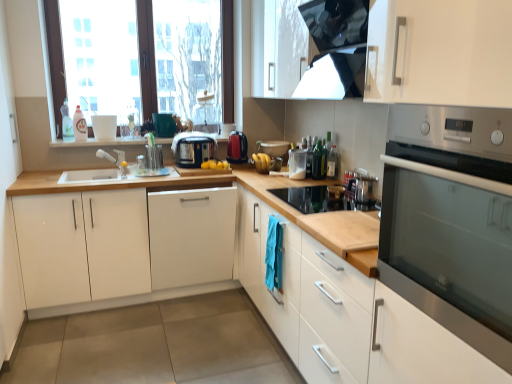
Image resolution: width=512 pixels, height=384 pixels. What are the coordinates of `clear plastic container at center, positioned as the 2th appliance in right-to-left order` in the screenshot? It's located at (297, 164).

How much space does clear plastic container at center, which is counted as the second appliance, starting from the front, occupy horizontally?

clear plastic container at center, which is counted as the second appliance, starting from the front, is 5.67 inches wide.

This screenshot has height=384, width=512. Identify the location of green glass bottle at center, which appears as the 2th bottle when viewed from the front. (319, 161).

This screenshot has height=384, width=512. Identify the location of satin silver toaster at upper right, placed as the 1th appliance when sorted from bottom to top. (364, 189).

The image size is (512, 384). What do you see at coordinates (115, 160) in the screenshot?
I see `white plastic faucet at upper left` at bounding box center [115, 160].

How much space does transparent plastic bottle at upper right, which appears as the 1th bottle when viewed from the front, occupy vertically?

The height of transparent plastic bottle at upper right, which appears as the 1th bottle when viewed from the front, is 9.37 inches.

What are the coordinates of `translucent plastic bottle at upper left, which is the third bottle from front to back` in the screenshot? It's located at (79, 126).

Considering the positions of point (262, 143) and point (365, 199), is point (262, 143) closer or farther from the camera than point (365, 199)?

Clearly, point (262, 143) is more distant from the camera than point (365, 199).

Which of these two, matte white bowl at center, placed as the third appliance when sorted from bottom to top, or satin silver toaster at upper right, the first appliance from the right, stands taller?

satin silver toaster at upper right, the first appliance from the right.

From a real-world perspective, is matte white bowl at center, which is the 3th appliance in front-to-back order, located beneath satin silver toaster at upper right, which ranks as the third appliance in top-to-bottom order?

No, from a real-world perspective, matte white bowl at center, which is the 3th appliance in front-to-back order, is not beneath satin silver toaster at upper right, which ranks as the third appliance in top-to-bottom order.

Consider the image. Between matte white bowl at center, the 1th appliance in the top-to-bottom sequence, and satin silver toaster at upper right, placed as the 1th appliance when sorted from front to back, which one appears on the right side from the viewer's perspective?

From the viewer's perspective, satin silver toaster at upper right, placed as the 1th appliance when sorted from front to back, appears more on the right side.

Is shiny plastic kettle at center, the first kitchen appliance viewed from the right, not close to white matte cabinet at left, which is the third cabinetry in right-to-left order?

No, shiny plastic kettle at center, the first kitchen appliance viewed from the right, is not far from white matte cabinet at left, which is the third cabinetry in right-to-left order.

Is point (230, 146) closer or farther from the camera than point (200, 279)?

Point (230, 146) is positioned farther from the camera compared to point (200, 279).

In the image, is shiny plastic kettle at center, the first kitchen appliance viewed from the right, positioned in front of or behind white matte cabinet at left, which is the third cabinetry in right-to-left order?

shiny plastic kettle at center, the first kitchen appliance viewed from the right, is behind white matte cabinet at left, which is the third cabinetry in right-to-left order.

Considering the sizes of objects shiny plastic kettle at center, the first kitchen appliance viewed from the right, and white matte cabinet at left, arranged as the first cabinetry when viewed from the left, in the image provided, who is wider, shiny plastic kettle at center, the first kitchen appliance viewed from the right, or white matte cabinet at left, arranged as the first cabinetry when viewed from the left,?

Wider between the two is white matte cabinet at left, arranged as the first cabinetry when viewed from the left.

How far apart are shiny plastic kettle at center, positioned as the 2th kitchen appliance in left-to-right order, and white plastic faucet at upper left?

A distance of 33.03 inches exists between shiny plastic kettle at center, positioned as the 2th kitchen appliance in left-to-right order, and white plastic faucet at upper left.

Considering the relative sizes of shiny plastic kettle at center, positioned as the 2th kitchen appliance in left-to-right order, and white plastic faucet at upper left in the image provided, is shiny plastic kettle at center, positioned as the 2th kitchen appliance in left-to-right order, wider than white plastic faucet at upper left?

Correct, the width of shiny plastic kettle at center, positioned as the 2th kitchen appliance in left-to-right order, exceeds that of white plastic faucet at upper left.

Is shiny plastic kettle at center, positioned as the 2th kitchen appliance in left-to-right order, facing towards white plastic faucet at upper left?

No.

Is green glass bottle at center, the 2th bottle viewed from the left, at the left side of white matte cabinet at right, which is counted as the third cabinetry, starting from the left?

In fact, green glass bottle at center, the 2th bottle viewed from the left, is to the right of white matte cabinet at right, which is counted as the third cabinetry, starting from the left.

Is green glass bottle at center, the 2th bottle viewed from the left, bigger or smaller than white matte cabinet at right, positioned as the 1th cabinetry in right-to-left order?

Clearly, green glass bottle at center, the 2th bottle viewed from the left, is smaller in size than white matte cabinet at right, positioned as the 1th cabinetry in right-to-left order.

What's the angular difference between green glass bottle at center, arranged as the second bottle when viewed from the back, and white matte cabinet at right, positioned as the 1th cabinetry in right-to-left order,'s facing directions?

green glass bottle at center, arranged as the second bottle when viewed from the back, and white matte cabinet at right, positioned as the 1th cabinetry in right-to-left order, are facing 0.104 degrees away from each other.

Is point (313, 163) farther from viewer compared to point (387, 338)?

Yes, point (313, 163) is farther from viewer.

Considering the positions of points (82, 145) and (313, 178), is point (82, 145) closer to camera compared to point (313, 178)?

No, (82, 145) is behind (313, 178).

Does wooden cutting board at center turn towards green glass bottle at center, the 2th bottle viewed from the left?

Yes, wooden cutting board at center faces towards green glass bottle at center, the 2th bottle viewed from the left.

From a real-world perspective, is wooden cutting board at center beneath green glass bottle at center, which appears as the 2th bottle when viewed from the front?

No.

Considering the relative sizes of wooden cutting board at center and green glass bottle at center, the second bottle from the right, in the image provided, is wooden cutting board at center bigger than green glass bottle at center, the second bottle from the right,?

Yes, wooden cutting board at center is bigger than green glass bottle at center, the second bottle from the right.

Which is behind, satin silver toaster at upper right, the first appliance from the right, or green glass bottle at center, arranged as the second bottle when viewed from the back?

green glass bottle at center, arranged as the second bottle when viewed from the back, is more distant.

Which object is positioned more to the left, satin silver toaster at upper right, which is the 3th appliance from back to front, or green glass bottle at center, arranged as the second bottle when viewed from the back?

From the viewer's perspective, green glass bottle at center, arranged as the second bottle when viewed from the back, appears more on the left side.

Is satin silver toaster at upper right, which ranks as the third appliance in top-to-bottom order, taller than green glass bottle at center, arranged as the second bottle when viewed from the back?

Incorrect, the height of satin silver toaster at upper right, which ranks as the third appliance in top-to-bottom order, is not larger of that of green glass bottle at center, arranged as the second bottle when viewed from the back.

From the image's perspective, which appliance is the 2nd one below the green glass bottle at center, arranged as the second bottle when viewed from the back? Please provide its 2D coordinates.

[(364, 189)]

In the image, is transparent plastic bottle at upper right, placed as the third bottle when sorted from left to right, on the left side or the right side of satin silver toaster at upper right, placed as the 1th appliance when sorted from bottom to top?

Based on their positions, transparent plastic bottle at upper right, placed as the third bottle when sorted from left to right, is located to the left of satin silver toaster at upper right, placed as the 1th appliance when sorted from bottom to top.

Is transparent plastic bottle at upper right, the third bottle positioned from the back, closer to the viewer compared to satin silver toaster at upper right, placed as the 1th appliance when sorted from bottom to top?

No, it is behind satin silver toaster at upper right, placed as the 1th appliance when sorted from bottom to top.

Between point (337, 178) and point (357, 177), which one is positioned behind?

Positioned behind is point (337, 178).

How different are the orientations of transparent plastic bottle at upper right, arranged as the first bottle when viewed from the right, and satin silver toaster at upper right, which is the 3th appliance from back to front, in degrees?

transparent plastic bottle at upper right, arranged as the first bottle when viewed from the right, and satin silver toaster at upper right, which is the 3th appliance from back to front, are facing 4.69 degrees away from each other.

Image resolution: width=512 pixels, height=384 pixels. What are the coordinates of `the 2nd appliance above the satin silver toaster at upper right, placed as the 1th appliance when sorted from front to back (from a real-world perspective)` in the screenshot? It's located at (273, 147).

Where is `the 2nd cabinetry counting from the left of the shiny plastic kettle at center, positioned as the 2th kitchen appliance in left-to-right order`? The height and width of the screenshot is (384, 512). the 2nd cabinetry counting from the left of the shiny plastic kettle at center, positioned as the 2th kitchen appliance in left-to-right order is located at coordinates (123, 247).

When comparing their distances from shiny plastic kettle at center, positioned as the 2th kitchen appliance in left-to-right order, does clear plastic container at center, which is counted as the second appliance, starting from the front, or white matte cabinet at center, acting as the 2th cabinetry starting from the left, seem closer?

clear plastic container at center, which is counted as the second appliance, starting from the front, is closer to shiny plastic kettle at center, positioned as the 2th kitchen appliance in left-to-right order.

Considering their positions, is black plastic toaster at center, the second kitchen appliance viewed from the right, positioned closer to translucent plastic bottle at upper left, which is the third bottle from front to back, than clear plastic container at center, placed as the 2th appliance when sorted from bottom to top?

Based on the image, black plastic toaster at center, the second kitchen appliance viewed from the right, appears to be nearer to translucent plastic bottle at upper left, which is the third bottle from front to back.

Considering their positions, is transparent plastic bottle at upper right, the third bottle positioned from the back, positioned closer to matte white bowl at center, acting as the 1th appliance starting from the left, than clear plastic container at center, the second appliance positioned from the back?

clear plastic container at center, the second appliance positioned from the back.

Looking at the image, which one is located closer to matte white bowl at center, acting as the 1th appliance starting from the left, white plastic faucet at upper left or black plastic toaster at center, positioned as the 1th kitchen appliance in left-to-right order?

black plastic toaster at center, positioned as the 1th kitchen appliance in left-to-right order, lies closer to matte white bowl at center, acting as the 1th appliance starting from the left, than the other object.

Based on their spatial positions, is stainless steel oven at right or white matte cabinet at center, which ranks as the 2th cabinetry in right-to-left order, further from wooden cutting board at center?

Based on the image, stainless steel oven at right appears to be further to wooden cutting board at center.

When comparing their distances from matte white bowl at center, which appears as the third appliance when viewed from the right, does black plastic toaster at center, positioned as the 1th kitchen appliance in left-to-right order, or white matte cabinet at left, arranged as the first cabinetry when viewed from the left, seem further?

white matte cabinet at left, arranged as the first cabinetry when viewed from the left.

When comparing their distances from white matte cabinet at left, which is the third cabinetry in right-to-left order, does satin silver toaster at upper right, which is counted as the third appliance, starting from the left, or transparent plastic bottle at upper right, the third bottle positioned from the back, seem further?

satin silver toaster at upper right, which is counted as the third appliance, starting from the left, is further to white matte cabinet at left, which is the third cabinetry in right-to-left order.

Considering their positions, is satin silver toaster at upper right, which is the 3th appliance from back to front, positioned closer to transparent glass window at upper left than green glass bottle at center, the second bottle from the right?

green glass bottle at center, the second bottle from the right, is positioned closer to the anchor transparent glass window at upper left.

Locate an element on the screen. The height and width of the screenshot is (384, 512). countertop between stainless steel oven at right and shiny plastic kettle at center, the first kitchen appliance viewed from the right, from front to back is located at coordinates (345, 298).

I want to click on window between wooden cutting board at center and satin silver toaster at upper right, placed as the 1th appliance when sorted from front to back, in the horizontal direction, so click(x=147, y=58).

Where is `window between white plastic faucet at upper left and matte white bowl at center, arranged as the 1th appliance when viewed from the back, from left to right`? The height and width of the screenshot is (384, 512). window between white plastic faucet at upper left and matte white bowl at center, arranged as the 1th appliance when viewed from the back, from left to right is located at coordinates (147, 58).

Where is `cabinetry that lies between translucent plastic bottle at upper left, which is the third bottle in right-to-left order, and white matte cabinet at left, which is the third cabinetry in right-to-left order, from top to bottom`? The width and height of the screenshot is (512, 384). cabinetry that lies between translucent plastic bottle at upper left, which is the third bottle in right-to-left order, and white matte cabinet at left, which is the third cabinetry in right-to-left order, from top to bottom is located at coordinates (191, 236).